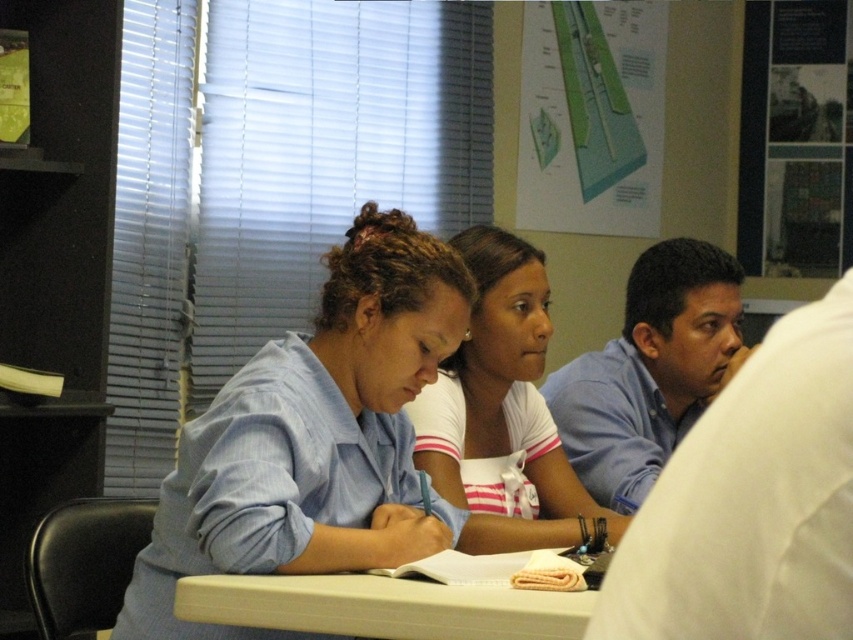
Question: Which point is farther to the camera?

Choices:
 (A) (775, 65)
 (B) (254, 508)

Answer: (A)

Question: Is blue shirt at center closer to camera compared to white plastic table at center?

Choices:
 (A) yes
 (B) no

Answer: (B)

Question: Can you confirm if green paper at upper center is positioned to the left of white plastic table at center?

Choices:
 (A) no
 (B) yes

Answer: (A)

Question: Among these points, which one is farthest from the camera?

Choices:
 (A) (503, 429)
 (B) (619, 348)
 (C) (320, 420)

Answer: (B)

Question: Can you confirm if white striped shirt at center is positioned to the left of green paper at upper center?

Choices:
 (A) no
 (B) yes

Answer: (B)

Question: Which object appears farthest from the camera in this image?

Choices:
 (A) white plastic table at center
 (B) blue striped shirt at center

Answer: (B)